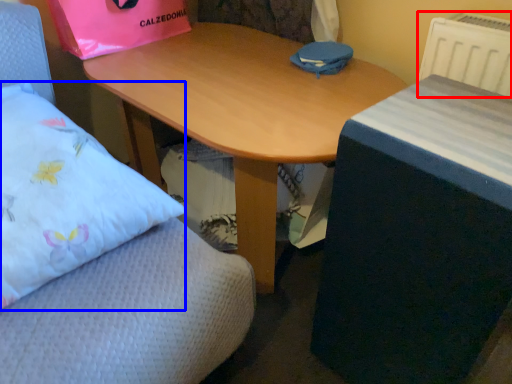
Question: Which point is further to the camera, radiator (highlighted by a red box) or pillow (highlighted by a blue box)?

Choices:
 (A) radiator
 (B) pillow

Answer: (A)